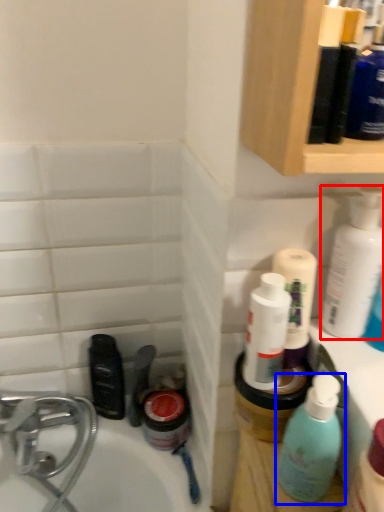
Question: Which object appears closest to the camera in this image, cleaning product (highlighted by a red box) or bottle (highlighted by a blue box)?

Choices:
 (A) cleaning product
 (B) bottle

Answer: (B)